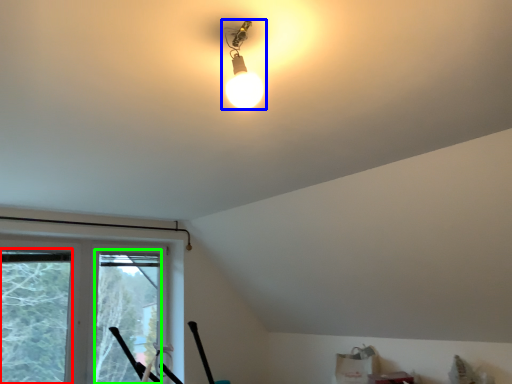
Question: Estimate the real-world distances between objects in this image. Which object is farther from window screen (highlighted by a red box), lamp (highlighted by a blue box) or window screen (highlighted by a green box)?

Choices:
 (A) lamp
 (B) window screen

Answer: (A)